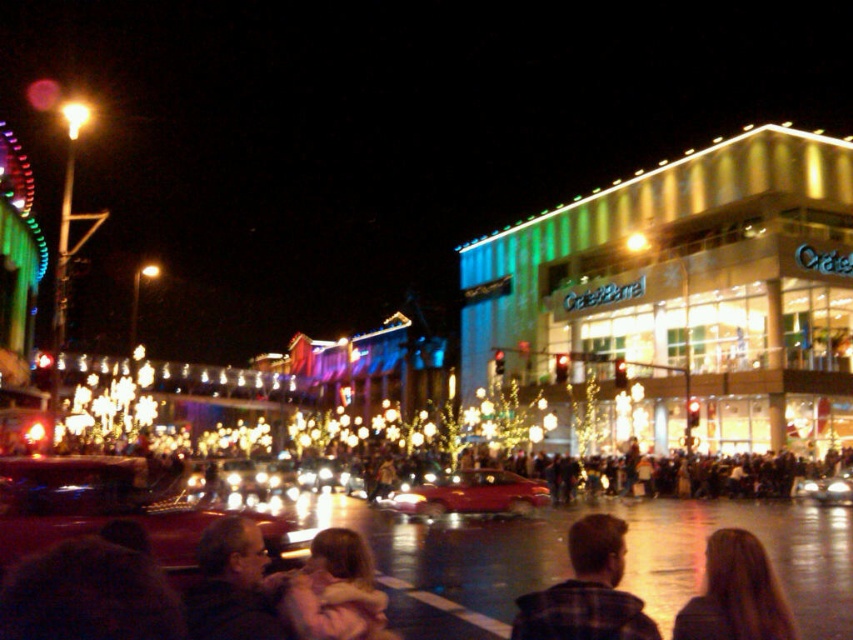
The image size is (853, 640). What do you see at coordinates (735, 593) in the screenshot?
I see `long brown hair at lower right` at bounding box center [735, 593].

Consider the image. Does long brown hair at lower right have a greater height compared to shiny silver car at center?

Yes.

Locate an element on the screen. Image resolution: width=853 pixels, height=640 pixels. long brown hair at lower right is located at coordinates (735, 593).

Is green glass building at upper right to the left of long brown hair at lower right from the viewer's perspective?

In fact, green glass building at upper right is to the right of long brown hair at lower right.

Find the location of `green glass building at upper right`. green glass building at upper right is located at coordinates (680, 301).

Image resolution: width=853 pixels, height=640 pixels. What are the coordinates of `green glass building at upper right` in the screenshot? It's located at (680, 301).

Between plaid fabric shirt at center and long brown hair at lower right, which one appears on the left side from the viewer's perspective?

plaid fabric shirt at center

Can you confirm if plaid fabric shirt at center is positioned above long brown hair at lower right?

No.

Measure the distance between point [558,627] and camera.

Point [558,627] and camera are 38.49 meters apart from each other.

Where is `plaid fabric shirt at center`? plaid fabric shirt at center is located at coordinates (585, 592).